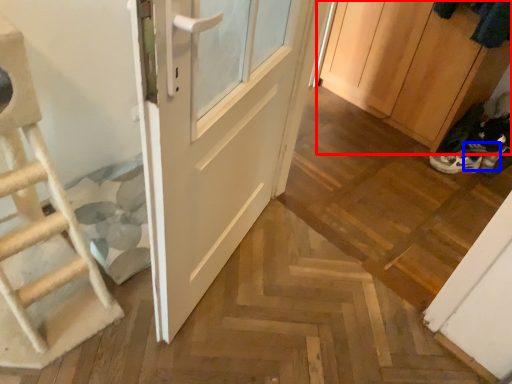
Question: Among these objects, which one is farthest to the camera, cabinetry (highlighted by a red box) or shoe (highlighted by a blue box)?

Choices:
 (A) cabinetry
 (B) shoe

Answer: (B)